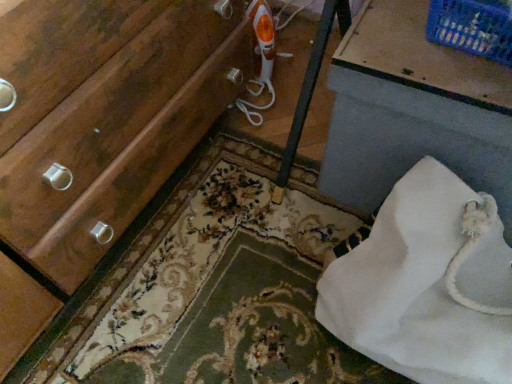
Question: Does point (495, 150) appear closer or farther from the camera than point (109, 254)?

Choices:
 (A) closer
 (B) farther

Answer: (A)

Question: Is white fabric bag at lower right taller or shorter than floral carpet at lower center?

Choices:
 (A) short
 (B) tall

Answer: (B)

Question: Estimate the real-world distances between objects in this image. Which object is closer to the blue plastic basket at upper right?

Choices:
 (A) white fabric bag at lower right
 (B) floral carpet at lower center

Answer: (A)

Question: Which object is positioned closest to the floral carpet at lower center?

Choices:
 (A) white fabric bag at lower right
 (B) blue plastic basket at upper right

Answer: (A)